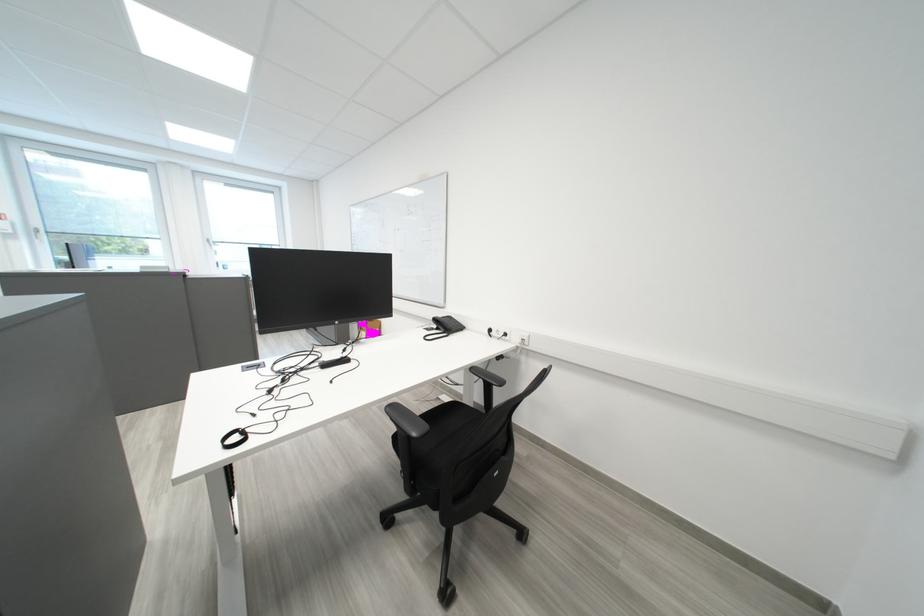
The height and width of the screenshot is (616, 924). In order to click on black chair armrest in this screenshot , I will do `click(406, 419)`.